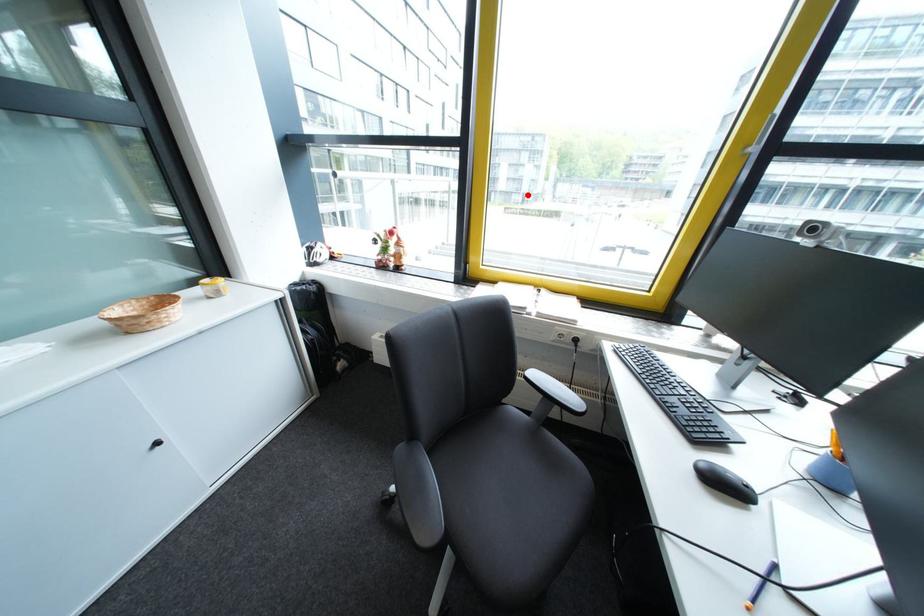
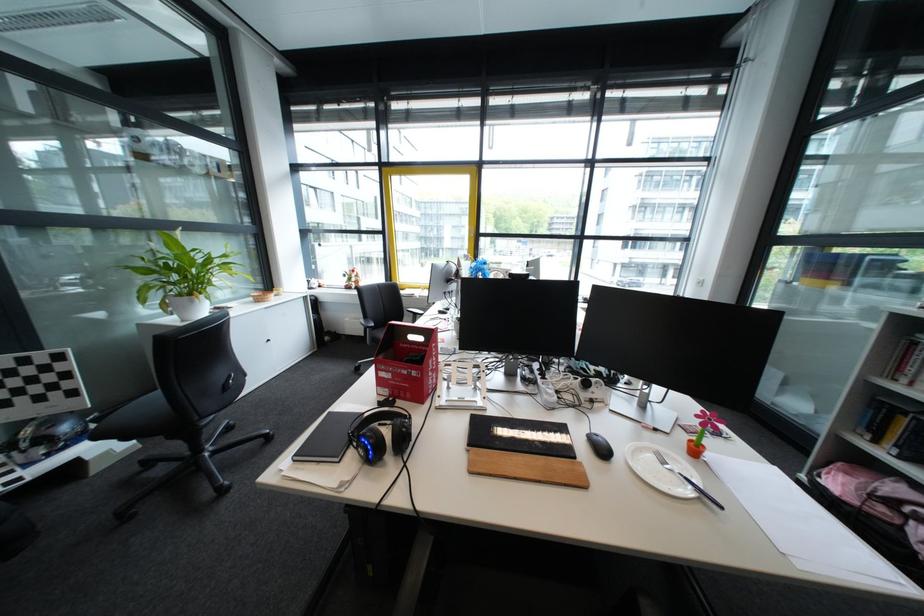
In the second image, find the point that corresponds to the highlighted location in the first image.

(472, 251)